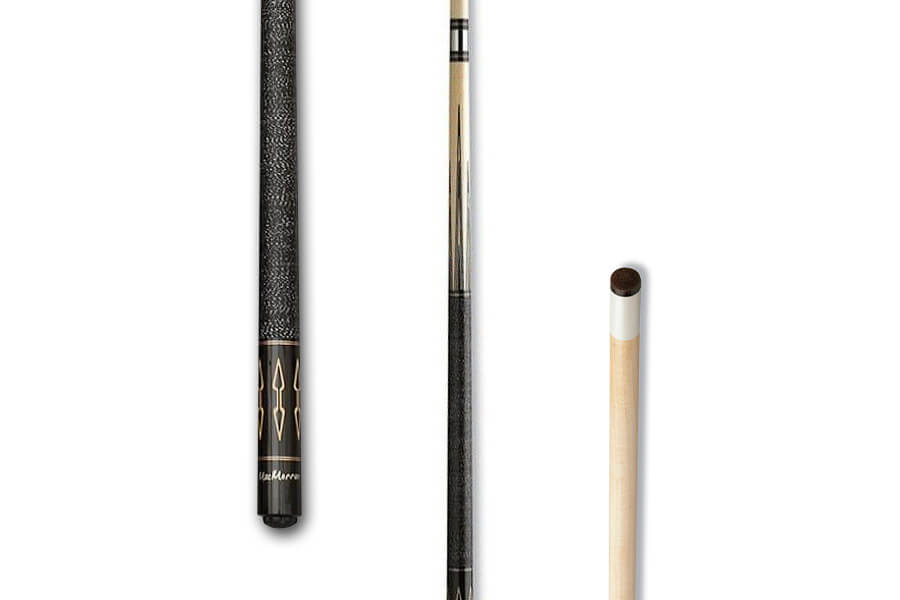
The image size is (900, 600). I want to click on pool cue tip, so click(627, 487).